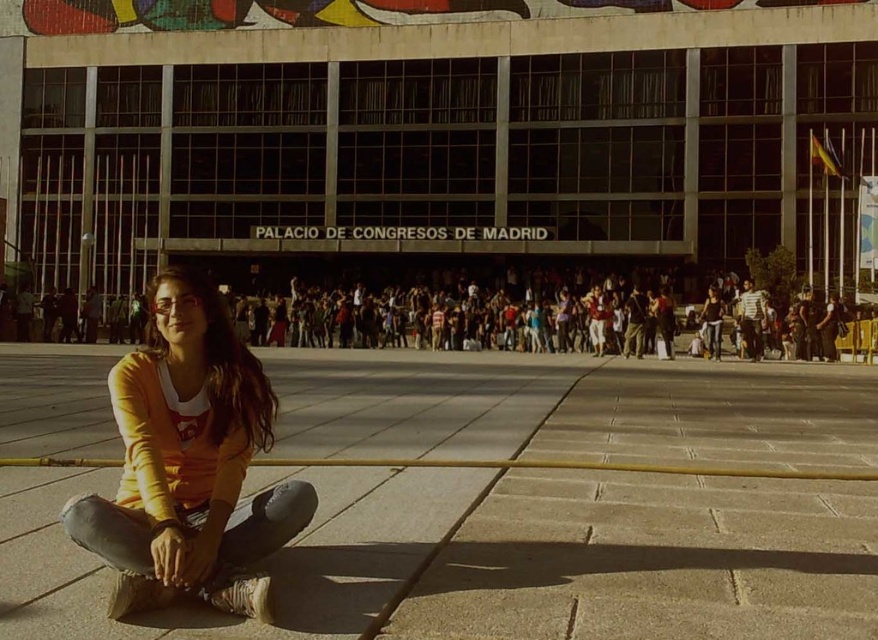
Question: Which point is farther to the camera?

Choices:
 (A) sandy concrete pavement at lower left
 (B) orange cotton shirt at lower left

Answer: (B)

Question: Is sandy concrete pavement at lower left above orange cotton shirt at lower left?

Choices:
 (A) yes
 (B) no

Answer: (B)

Question: Is sandy concrete pavement at lower left positioned at the back of orange cotton shirt at lower left?

Choices:
 (A) no
 (B) yes

Answer: (A)

Question: Is sandy concrete pavement at lower left positioned behind orange cotton shirt at lower left?

Choices:
 (A) yes
 (B) no

Answer: (B)

Question: Which object is closer to the camera taking this photo?

Choices:
 (A) sandy concrete pavement at lower left
 (B) orange cotton shirt at lower left

Answer: (A)

Question: Which point appears farthest from the camera in this image?

Choices:
 (A) (210, 561)
 (B) (661, 493)

Answer: (B)